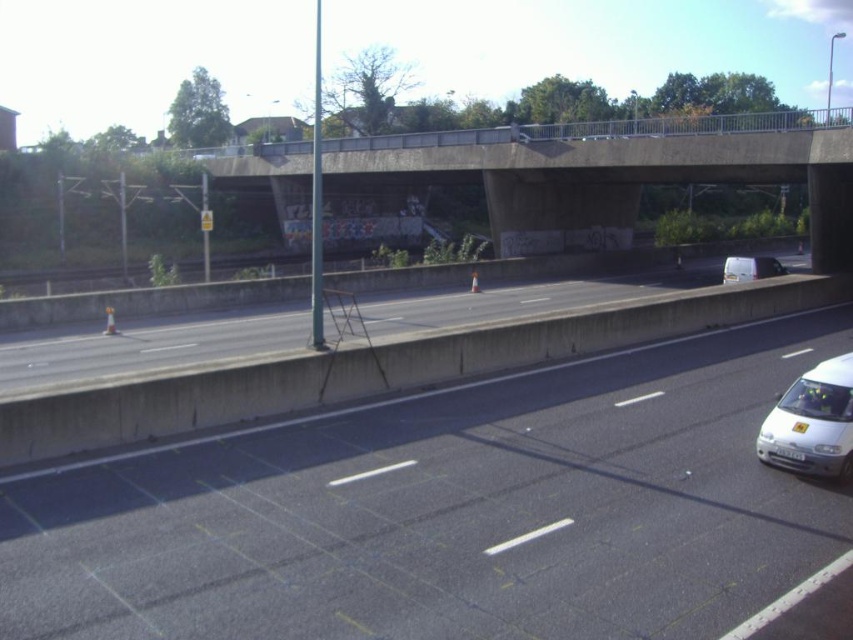
The height and width of the screenshot is (640, 853). What do you see at coordinates (447, 509) in the screenshot?
I see `black asphalt highway at center` at bounding box center [447, 509].

Can you confirm if black asphalt highway at center is positioned to the left of white glossy car at lower right?

Yes, black asphalt highway at center is to the left of white glossy car at lower right.

Find the location of `black asphalt highway at center`. black asphalt highway at center is located at coordinates (447, 509).

Does black asphalt highway at center appear over white matte van at center?

No.

Is black asphalt highway at center positioned at the back of white matte van at center?

No, black asphalt highway at center is in front of white matte van at center.

Where is `black asphalt highway at center`? The image size is (853, 640). black asphalt highway at center is located at coordinates (447, 509).

At what (x,y) coordinates should I click in order to perform the action: click on white glossy car at lower right. Please return your answer as a coordinate pair (x, y). Looking at the image, I should click on (811, 422).

Does white glossy car at lower right appear under white matte van at center?

Yes, white glossy car at lower right is below white matte van at center.

What do you see at coordinates (811, 422) in the screenshot?
I see `white glossy car at lower right` at bounding box center [811, 422].

The width and height of the screenshot is (853, 640). I want to click on white glossy car at lower right, so click(x=811, y=422).